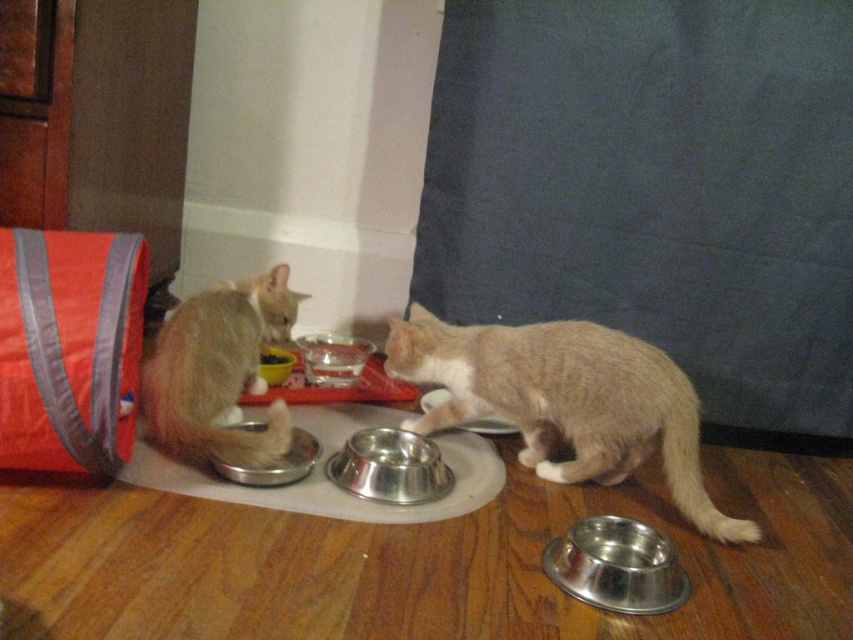
Is light brown fur at center to the left of shiny metallic bowl at lower right from the viewer's perspective?

Correct, you'll find light brown fur at center to the left of shiny metallic bowl at lower right.

Can you confirm if light brown fur at center is positioned below shiny metallic bowl at lower right?

No, light brown fur at center is not below shiny metallic bowl at lower right.

You are a GUI agent. You are given a task and a screenshot of the screen. Output one action in this format:
    pyautogui.click(x=<x>, y=<y>)
    Task: Click on the light brown fur at center
    
    Given the screenshot: What is the action you would take?
    click(x=566, y=401)

Image resolution: width=853 pixels, height=640 pixels. Describe the element at coordinates (566, 401) in the screenshot. I see `light brown fur at center` at that location.

Between point (523, 356) and point (415, 486), which one is positioned in front?

Point (415, 486)

Who is more distant from viewer, (415,326) or (398,492)?

The point (415,326) is behind.

The image size is (853, 640). I want to click on light brown fur at center, so click(x=566, y=401).

Does brushed metal bowl at lower center have a greater width compared to metallic silver bowl at center?

Correct, the width of brushed metal bowl at lower center exceeds that of metallic silver bowl at center.

Which is more to the left, brushed metal bowl at lower center or metallic silver bowl at center?

Positioned to the left is metallic silver bowl at center.

Locate an element on the screen. This screenshot has height=640, width=853. brushed metal bowl at lower center is located at coordinates (276, 465).